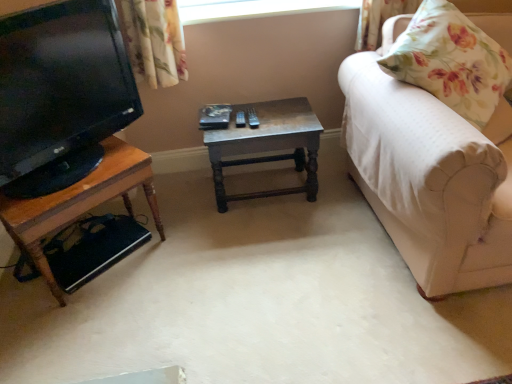
Question: Could you tell me if transparent glass window at upper center is facing matte black tv at left?

Choices:
 (A) yes
 (B) no

Answer: (B)

Question: Is transparent glass window at upper center to the left of matte black tv at left from the viewer's perspective?

Choices:
 (A) yes
 (B) no

Answer: (B)

Question: Does transparent glass window at upper center appear on the right side of matte black tv at left?

Choices:
 (A) no
 (B) yes

Answer: (B)

Question: Is transparent glass window at upper center in contact with matte black tv at left?

Choices:
 (A) yes
 (B) no

Answer: (B)

Question: Would you say transparent glass window at upper center contains matte black tv at left?

Choices:
 (A) no
 (B) yes

Answer: (A)

Question: From the image's perspective, is transparent glass window at upper center below matte black tv at left?

Choices:
 (A) yes
 (B) no

Answer: (B)

Question: From a real-world perspective, is floral fabric pillow at right positioned over matte black tv at left based on gravity?

Choices:
 (A) yes
 (B) no

Answer: (B)

Question: Is floral fabric pillow at right next to matte black tv at left?

Choices:
 (A) yes
 (B) no

Answer: (B)

Question: Can you confirm if floral fabric pillow at right is bigger than matte black tv at left?

Choices:
 (A) yes
 (B) no

Answer: (A)

Question: Is floral fabric pillow at right aimed at matte black tv at left?

Choices:
 (A) yes
 (B) no

Answer: (B)

Question: Is floral fabric pillow at right oriented away from matte black tv at left?

Choices:
 (A) no
 (B) yes

Answer: (A)

Question: From the image's perspective, would you say floral fabric pillow at right is positioned over matte black tv at left?

Choices:
 (A) no
 (B) yes

Answer: (B)

Question: Does wooden table at center, positioned as the second table in left-to-right order, appear on the left side of white fabric couch at right?

Choices:
 (A) yes
 (B) no

Answer: (A)